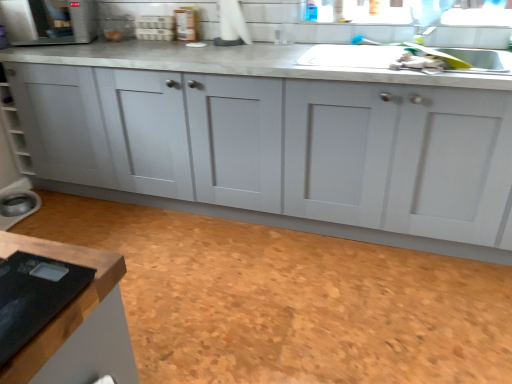
Locate an element on the screen. This screenshot has height=384, width=512. satin silver microwave at upper left, the 2th appliance viewed from the left is located at coordinates (49, 21).

The image size is (512, 384). What do you see at coordinates (154, 28) in the screenshot? I see `white plastic egg carton at upper center, which ranks as the 3th appliance in left-to-right order` at bounding box center [154, 28].

Identify the location of white plastic egg carton at upper center, the second appliance viewed from the top. Image resolution: width=512 pixels, height=384 pixels. (154, 28).

In order to face matte brown jar at upper center, placed as the 4th appliance when sorted from left to right, should I rotate leftwards or rightwards?

Turn left by 8.773 degrees to look at matte brown jar at upper center, placed as the 4th appliance when sorted from left to right.

At what (x,y) coordinates should I click in order to perform the action: click on white matte cabinet at center. Please return your answer as a coordinate pair (x, y). Image resolution: width=512 pixels, height=384 pixels. Looking at the image, I should click on (224, 145).

You are a GUI agent. You are given a task and a screenshot of the screen. Output one action in this format:
    pyautogui.click(x=<x>, y=<y>)
    Task: Click on the matte white kettle at lower left, the 1th appliance when ordered from left to right
    This screenshot has height=384, width=512.
    Given the screenshot: What is the action you would take?
    pyautogui.click(x=17, y=206)

Does matte white kettle at lower left, the 1th appliance from the bottom, touch brown cork floor at lower center?

matte white kettle at lower left, the 1th appliance from the bottom, is not next to brown cork floor at lower center, and they're not touching.

Does matte white kettle at lower left, the 1th appliance from the bottom, have a smaller size compared to brown cork floor at lower center?

Correct, matte white kettle at lower left, the 1th appliance from the bottom, occupies less space than brown cork floor at lower center.

Is the position of matte white kettle at lower left, the 1th appliance when ordered from left to right, more distant than that of brown cork floor at lower center?

Yes.

Looking at this image, is brown cork floor at lower center inside matte white kettle at lower left, the 1th appliance from the bottom?

No, brown cork floor at lower center is not inside matte white kettle at lower left, the 1th appliance from the bottom.

Based on the photo, relative to white plastic egg carton at upper center, the 2th appliance when ordered from right to left, is satin silver microwave at upper left, placed as the 3th appliance when sorted from right to left, in front or behind?

Visually, satin silver microwave at upper left, placed as the 3th appliance when sorted from right to left, is located in front of white plastic egg carton at upper center, the 2th appliance when ordered from right to left.

From the image's perspective, which one is positioned higher, satin silver microwave at upper left, the 2th appliance viewed from the left, or white plastic egg carton at upper center, acting as the third appliance starting from the bottom?

satin silver microwave at upper left, the 2th appliance viewed from the left.

Does satin silver microwave at upper left, which ranks as the first appliance in top-to-bottom order, appear on the left side of white plastic egg carton at upper center, the second appliance viewed from the top?

Indeed, satin silver microwave at upper left, which ranks as the first appliance in top-to-bottom order, is positioned on the left side of white plastic egg carton at upper center, the second appliance viewed from the top.

Does satin silver microwave at upper left, the 2th appliance viewed from the left, have a greater height compared to white plastic egg carton at upper center, the second appliance viewed from the top?

Yes, satin silver microwave at upper left, the 2th appliance viewed from the left, is taller than white plastic egg carton at upper center, the second appliance viewed from the top.

Does white matte cabinet at center touch satin silver microwave at upper left, which ranks as the first appliance in top-to-bottom order?

No, white matte cabinet at center is not in contact with satin silver microwave at upper left, which ranks as the first appliance in top-to-bottom order.

In the scene shown: Is white matte cabinet at center further to the viewer compared to satin silver microwave at upper left, placed as the 3th appliance when sorted from right to left?

No, it is in front of satin silver microwave at upper left, placed as the 3th appliance when sorted from right to left.

From a real-world perspective, who is located lower, white matte cabinet at center or satin silver microwave at upper left, which is counted as the 4th appliance, starting from the bottom?

white matte cabinet at center, from a real-world perspective.

This screenshot has height=384, width=512. In the image, there is a satin silver microwave at upper left, which is counted as the 4th appliance, starting from the bottom. What are the coordinates of `cabinetry below it (from the image's perspective)` in the screenshot? It's located at (224, 145).

Measure the distance between satin silver microwave at upper left, which is counted as the 4th appliance, starting from the bottom, and brown cork floor at lower center.

satin silver microwave at upper left, which is counted as the 4th appliance, starting from the bottom, is 1.46 meters from brown cork floor at lower center.

How many degrees apart are the facing directions of satin silver microwave at upper left, which is counted as the 4th appliance, starting from the bottom, and brown cork floor at lower center?

They differ by 156 degrees in their facing directions.

In the scene shown: From the image's perspective, is satin silver microwave at upper left, which is counted as the 4th appliance, starting from the bottom, above brown cork floor at lower center?

Yes, from the image's perspective, satin silver microwave at upper left, which is counted as the 4th appliance, starting from the bottom, is on top of brown cork floor at lower center.

Is brown cork floor at lower center located within satin silver microwave at upper left, which is counted as the 4th appliance, starting from the bottom?

Actually, brown cork floor at lower center is outside satin silver microwave at upper left, which is counted as the 4th appliance, starting from the bottom.

Is brown cork floor at lower center positioned far away from white plastic egg carton at upper center, acting as the third appliance starting from the bottom?

Absolutely, brown cork floor at lower center is distant from white plastic egg carton at upper center, acting as the third appliance starting from the bottom.

Does brown cork floor at lower center have a lesser width compared to white plastic egg carton at upper center, acting as the third appliance starting from the bottom?

Incorrect, the width of brown cork floor at lower center is not less than that of white plastic egg carton at upper center, acting as the third appliance starting from the bottom.

In the image, is brown cork floor at lower center positioned in front of or behind white plastic egg carton at upper center, the second appliance viewed from the top?

brown cork floor at lower center is positioned closer to the viewer than white plastic egg carton at upper center, the second appliance viewed from the top.

Is brown cork floor at lower center aimed at white plastic egg carton at upper center, acting as the third appliance starting from the bottom?

No, brown cork floor at lower center does not turn towards white plastic egg carton at upper center, acting as the third appliance starting from the bottom.

In order to click on granite below the satin silver microwave at upper left, which ranks as the first appliance in top-to-bottom order (from the image's perspective) in this screenshot , I will do `click(289, 300)`.

Is there a large distance between brown cork floor at lower center and satin silver microwave at upper left, which is counted as the 4th appliance, starting from the bottom?

Yes, brown cork floor at lower center and satin silver microwave at upper left, which is counted as the 4th appliance, starting from the bottom, are located far from each other.

How much distance is there between brown cork floor at lower center and satin silver microwave at upper left, which ranks as the first appliance in top-to-bottom order?

brown cork floor at lower center is 1.46 meters from satin silver microwave at upper left, which ranks as the first appliance in top-to-bottom order.

Does point (345, 219) come in front of point (167, 32)?

Yes.

From a real-world perspective, who is located lower, white matte cabinet at center or white plastic egg carton at upper center, which ranks as the 3th appliance in left-to-right order?

white matte cabinet at center is physically lower.

At what (x,y) coordinates should I click in order to perform the action: click on cabinetry on the right of white plastic egg carton at upper center, acting as the third appliance starting from the bottom. Please return your answer as a coordinate pair (x, y). This screenshot has height=384, width=512. Looking at the image, I should click on (224, 145).

Does white matte cabinet at center have a greater height compared to white plastic egg carton at upper center, the 2th appliance when ordered from right to left?

Correct, white matte cabinet at center is much taller as white plastic egg carton at upper center, the 2th appliance when ordered from right to left.

From the brown cork floor at lower center, count the 4th appliance to the left and point to it. Please provide its 2D coordinates.

[(17, 206)]

Locate an element on the screen. This screenshot has height=384, width=512. appliance located above the white plastic egg carton at upper center, the 2th appliance when ordered from right to left (from the image's perspective) is located at coordinates (49, 21).

Based on their spatial positions, is brown cork floor at lower center or satin silver microwave at upper left, which is counted as the 4th appliance, starting from the bottom, further from matte white kettle at lower left, the 1th appliance from the bottom?

brown cork floor at lower center is positioned further to the anchor matte white kettle at lower left, the 1th appliance from the bottom.

Estimate the real-world distances between objects in this image. Which object is closer to brown cork floor at lower center, matte brown jar at upper center, the 1th appliance positioned from the right, or satin silver microwave at upper left, which ranks as the first appliance in top-to-bottom order?

Based on the image, matte brown jar at upper center, the 1th appliance positioned from the right, appears to be nearer to brown cork floor at lower center.

When comparing their distances from brown cork floor at lower center, does white plastic egg carton at upper center, which ranks as the 3th appliance in left-to-right order, or satin silver microwave at upper left, placed as the 3th appliance when sorted from right to left, seem closer?

The object closer to brown cork floor at lower center is satin silver microwave at upper left, placed as the 3th appliance when sorted from right to left.

Based on their spatial positions, is brown cork floor at lower center or matte brown jar at upper center, the 1th appliance positioned from the right, closer to white plastic egg carton at upper center, which ranks as the 3th appliance in left-to-right order?

The object closer to white plastic egg carton at upper center, which ranks as the 3th appliance in left-to-right order, is matte brown jar at upper center, the 1th appliance positioned from the right.

When comparing their distances from matte white kettle at lower left, the 1th appliance from the bottom, does matte brown jar at upper center, placed as the 4th appliance when sorted from left to right, or brown cork floor at lower center seem further?

The object further to matte white kettle at lower left, the 1th appliance from the bottom, is matte brown jar at upper center, placed as the 4th appliance when sorted from left to right.

Which object lies further to the anchor point white matte cabinet at center, white plastic egg carton at upper center, the 2th appliance when ordered from right to left, or satin silver microwave at upper left, which is counted as the 4th appliance, starting from the bottom?

white plastic egg carton at upper center, the 2th appliance when ordered from right to left, is further to white matte cabinet at center.

When comparing their distances from matte white kettle at lower left, arranged as the 4th appliance when viewed from the top, does satin silver microwave at upper left, which is counted as the 4th appliance, starting from the bottom, or matte brown jar at upper center, the 1th appliance positioned from the right, seem further?

matte brown jar at upper center, the 1th appliance positioned from the right.

Considering their positions, is white plastic egg carton at upper center, the 2th appliance when ordered from right to left, positioned closer to matte brown jar at upper center, positioned as the third appliance in top-to-bottom order, than brown cork floor at lower center?

Based on the image, white plastic egg carton at upper center, the 2th appliance when ordered from right to left, appears to be nearer to matte brown jar at upper center, positioned as the third appliance in top-to-bottom order.

Identify the location of appliance between matte brown jar at upper center, the 1th appliance positioned from the right, and brown cork floor at lower center from top to bottom. This screenshot has height=384, width=512. (17, 206).

Image resolution: width=512 pixels, height=384 pixels. I want to click on appliance between white plastic egg carton at upper center, which ranks as the 3th appliance in left-to-right order, and matte white kettle at lower left, arranged as the 4th appliance when viewed from the right, in the up-down direction, so click(187, 24).

Where is `cabinetry that lies between matte brown jar at upper center, positioned as the third appliance in top-to-bottom order, and brown cork floor at lower center from top to bottom`? This screenshot has width=512, height=384. cabinetry that lies between matte brown jar at upper center, positioned as the third appliance in top-to-bottom order, and brown cork floor at lower center from top to bottom is located at coordinates (224, 145).

Identify the location of cabinetry between white plastic egg carton at upper center, which ranks as the 3th appliance in left-to-right order, and brown cork floor at lower center in the up-down direction. This screenshot has height=384, width=512. (224, 145).